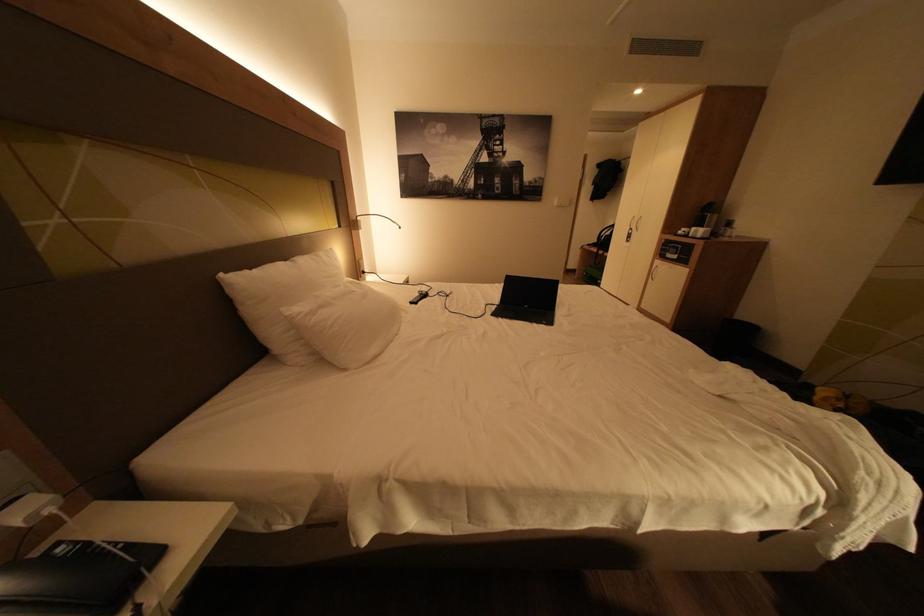
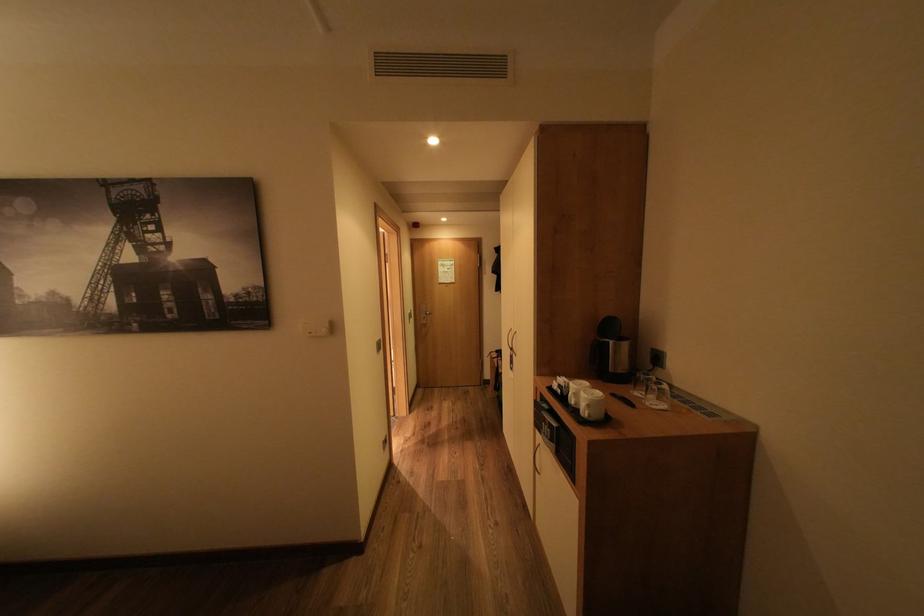
Find the pixel in the second image that matches (x=714, y=233) in the first image.

(600, 406)